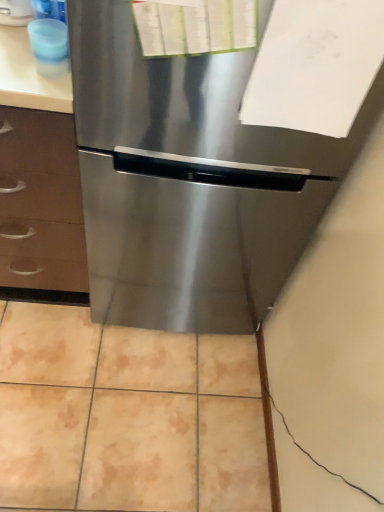
You are a GUI agent. You are given a task and a screenshot of the screen. Output one action in this format:
    pyautogui.click(x=<x>, y=<y>)
    Task: Click on the free space in front of translucent blue cup at upper left
    
    Given the screenshot: What is the action you would take?
    pyautogui.click(x=38, y=89)